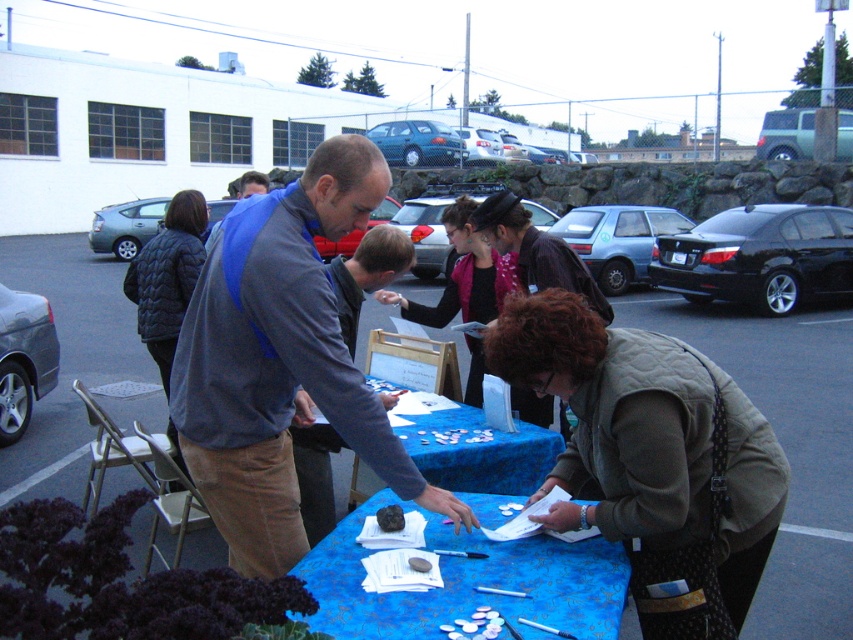
Question: Which point is farther from the camera taking this photo?

Choices:
 (A) (386, 513)
 (B) (366, 259)

Answer: (B)

Question: Can you confirm if matte black vest at center is positioned below matte gray jacket at center?

Choices:
 (A) yes
 (B) no

Answer: (B)

Question: Among these points, which one is farthest from the camera?

Choices:
 (A) (192, 218)
 (B) (383, 531)
 (C) (538, 284)

Answer: (A)

Question: Which point is closer to the camera?

Choices:
 (A) (190, 193)
 (B) (535, 406)

Answer: (B)

Question: Can you confirm if matte black vest at center is smaller than matte gray jacket at center?

Choices:
 (A) no
 (B) yes

Answer: (A)

Question: Does blue fabric tablecloth at center come behind quilted black jacket at left?

Choices:
 (A) no
 (B) yes

Answer: (A)